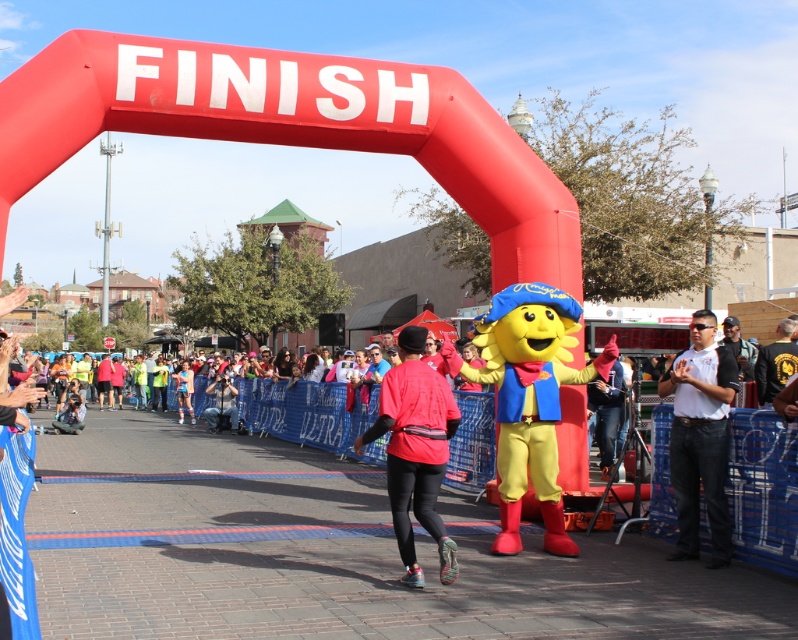
The height and width of the screenshot is (640, 798). I want to click on red matte running outfit at center, so click(x=415, y=451).

Does red matte running outfit at center have a greater height compared to white shirt at center?

Incorrect, red matte running outfit at center's height is not larger of white shirt at center's.

Is point (417, 337) closer to camera compared to point (710, 516)?

Yes.

This screenshot has height=640, width=798. Find the location of `red matte running outfit at center`. red matte running outfit at center is located at coordinates (415, 451).